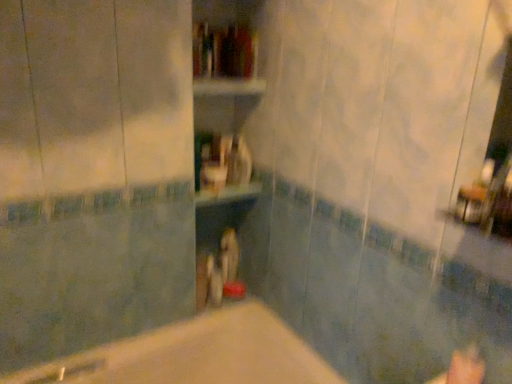
Question: Is the surface of wooden shelf at center in direct contact with hardcover book at center?

Choices:
 (A) no
 (B) yes

Answer: (A)

Question: Is the depth of wooden shelf at center less than that of hardcover book at center?

Choices:
 (A) no
 (B) yes

Answer: (B)

Question: Is wooden shelf at center taller than hardcover book at center?

Choices:
 (A) yes
 (B) no

Answer: (A)

Question: Does wooden shelf at center appear on the left side of hardcover book at center?

Choices:
 (A) no
 (B) yes

Answer: (B)

Question: From a real-world perspective, is wooden shelf at center physically above hardcover book at center?

Choices:
 (A) yes
 (B) no

Answer: (B)

Question: From a real-world perspective, is hardcover book at center physically located above or below wooden shelf at center?

Choices:
 (A) above
 (B) below

Answer: (A)

Question: Is hardcover book at center spatially inside wooden shelf at center, or outside of it?

Choices:
 (A) outside
 (B) inside

Answer: (B)

Question: From the image's perspective, relative to wooden shelf at center, is hardcover book at center above or below?

Choices:
 (A) above
 (B) below

Answer: (A)

Question: Based on their positions, is hardcover book at center located to the left or right of wooden shelf at center?

Choices:
 (A) right
 (B) left

Answer: (A)

Question: Which is correct: hardcover book at center is inside beige matte bathtub at center, or outside of it?

Choices:
 (A) inside
 (B) outside

Answer: (B)

Question: From the image's perspective, relative to beige matte bathtub at center, is hardcover book at center above or below?

Choices:
 (A) above
 (B) below

Answer: (A)

Question: In terms of width, does hardcover book at center look wider or thinner when compared to beige matte bathtub at center?

Choices:
 (A) thin
 (B) wide

Answer: (A)

Question: Does point (229, 69) appear closer or farther from the camera than point (270, 382)?

Choices:
 (A) farther
 (B) closer

Answer: (A)

Question: Do you think beige matte bathtub at center is within hardcover book at center, or outside of it?

Choices:
 (A) inside
 (B) outside

Answer: (B)

Question: From the image's perspective, is beige matte bathtub at center located above or below hardcover book at center?

Choices:
 (A) below
 (B) above

Answer: (A)